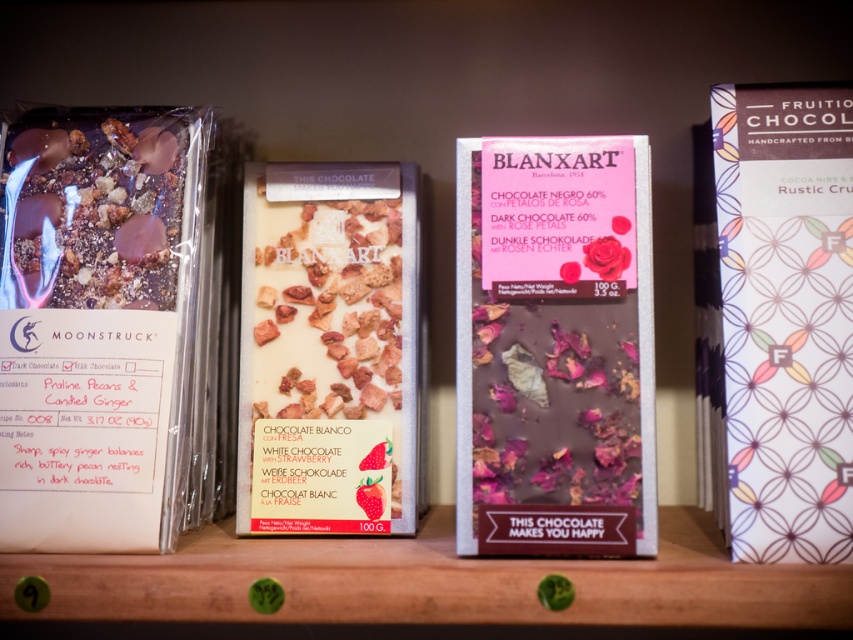
Question: Where is white matte chocolate bar at right located in relation to white chocolate with rose petals at center in the image?

Choices:
 (A) left
 (B) right

Answer: (B)

Question: Which is nearer to the white chocolate with rose petals at center?

Choices:
 (A) white chocolate bar with rose petals at center
 (B) white matte chocolate bar at right
 (C) shiny chocolate bar at left

Answer: (A)

Question: Which of these objects is positioned closest to the white matte chocolate bar at right?

Choices:
 (A) pink matte chocolate bar at center
 (B) shiny chocolate bar at left
 (C) matte dark chocolate bar at left
 (D) white chocolate with rose petals at center

Answer: (A)

Question: Considering the real-world distances, which object is closest to the shiny chocolate bar at left?

Choices:
 (A) white matte chocolate bar at right
 (B) matte dark chocolate bar at left
 (C) pink matte chocolate bar at center
 (D) white chocolate bar with rose petals at center

Answer: (B)

Question: Does pink matte chocolate bar at center have a greater width compared to white chocolate bar with rose petals at center?

Choices:
 (A) yes
 (B) no

Answer: (B)

Question: Is white chocolate bar with rose petals at center smaller than shiny chocolate bar at left?

Choices:
 (A) yes
 (B) no

Answer: (B)